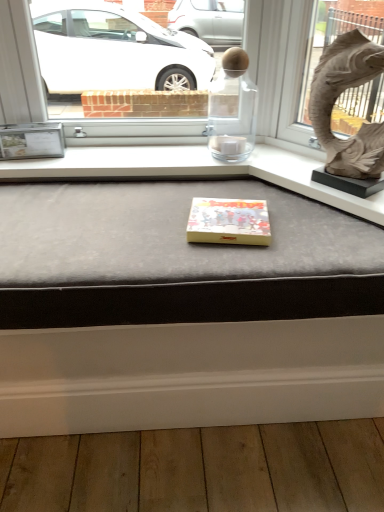
Question: Considering their positions, is matte gray cushion at center located in front of or behind yellow matte box at center?

Choices:
 (A) behind
 (B) front

Answer: (B)

Question: Is matte gray cushion at center situated inside yellow matte box at center or outside?

Choices:
 (A) inside
 (B) outside

Answer: (B)

Question: Which object is positioned farthest from the matte gray cushion at center?

Choices:
 (A) matte stone animal at upper right
 (B) yellow matte box at center

Answer: (A)

Question: Which of these objects is positioned closest to the matte gray cushion at center?

Choices:
 (A) yellow matte box at center
 (B) matte stone animal at upper right

Answer: (A)